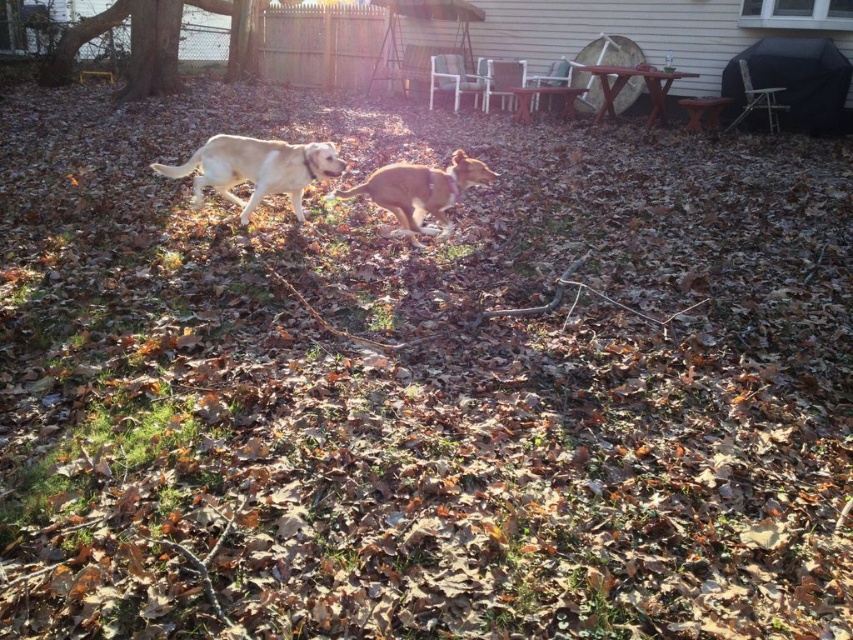
You are standing at the camera position and want to locate the golden fur dog at center. What are its coordinates in the image?

The golden fur dog at center is located at coordinates (x=256, y=168).

You are a photographer trying to capture both the golden fur dog at center and the golden brown fur at center in a single frame. Given their widths, which dog should you focus on to ensure both fit in the frame without cropping?

The golden fur dog at center has a greater width than the golden brown fur at center. To ensure both fit in the frame without cropping, focus on the golden fur dog at center as it is wider, allowing the smaller golden brown fur at center to fit alongside.

You are a photographer trying to capture both the golden fur dog at center and the golden brown fur at center in a single shot. Given that your camera has a limited depth of field, which dog should you focus on to ensure the larger one is in sharp focus?

The golden fur dog at center is larger in size than the golden brown fur at center, so you should focus on the golden fur dog at center to ensure it is in sharp focus.